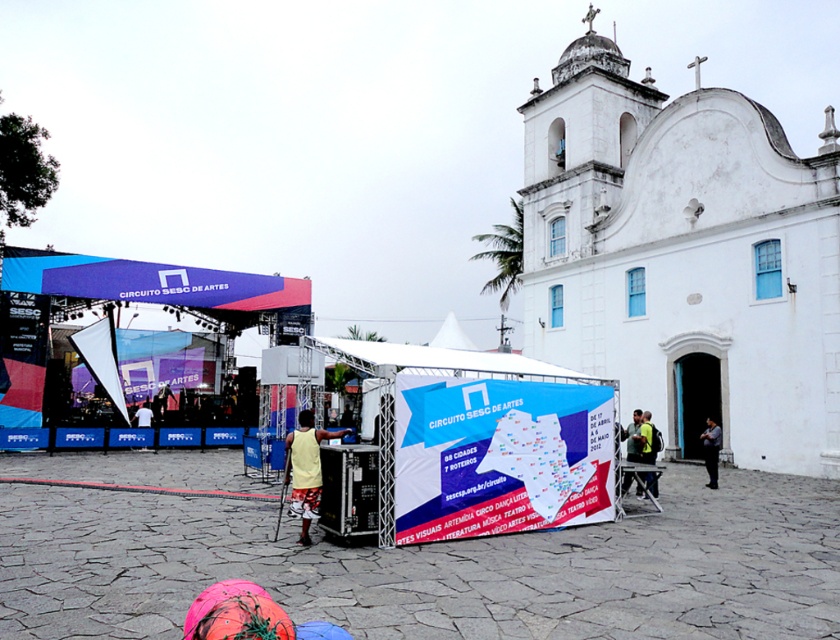
You are an event organizer at the CIRCUITO SESC DE ARTES. You need to place a decorative item on the stage. The green fabric bag at center and the white fabric shirt at center are both available. Which item should you choose if you want something taller?

The green fabric bag at center is taller than the white fabric shirt at center, so you should choose the green fabric bag at center for a taller decorative item.

You are standing in front of the stage at the cultural event. There are two points marked on the stage floor. One is at coordinate point (315, 460) and the other is at point (631, 460). Which point is closer to you?

Point (315, 460) is closer to the camera than point (631, 460), so the point at (315, 460) is closer to you.

You are an event organizer checking the stage setup. You notice the green fabric bag at center and the white fabric shirt at center. Which item is positioned higher relative to the other?

The green fabric bag at center is above the white fabric shirt at center.